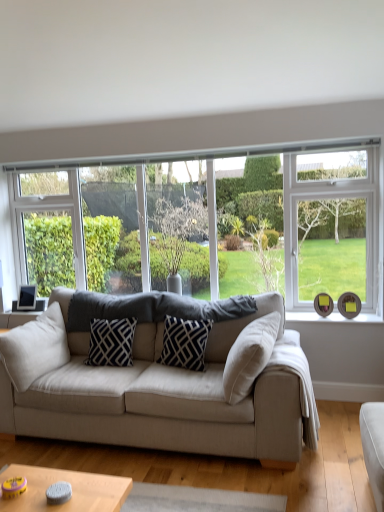
Question: Considering the positions of clear glass window at center and navy blue fabric pillow at center, the first pillow positioned from the right, in the image, is clear glass window at center taller or shorter than navy blue fabric pillow at center, the first pillow positioned from the right,?

Choices:
 (A) short
 (B) tall

Answer: (B)

Question: Considering the relative positions of clear glass window at center and navy blue fabric pillow at center, the 3th pillow in the left-to-right sequence, in the image provided, is clear glass window at center to the left or to the right of navy blue fabric pillow at center, the 3th pillow in the left-to-right sequence,?

Choices:
 (A) right
 (B) left

Answer: (B)

Question: Estimate the real-world distances between objects in this image. Which object is farther from the beige fabric couch at center?

Choices:
 (A) clear glass window at center
 (B) green leafy tree at center
 (C) navy blue fabric pillow at center, the first pillow positioned from the right
 (D) beige fabric pillow at left, which is counted as the first pillow, starting from the left
 (E) black and white patterned pillow at center, arranged as the second pillow when viewed from the right

Answer: (A)

Question: Considering the real-world distances, which object is closest to the green leafy tree at center?

Choices:
 (A) beige fabric pillow at left, which is counted as the first pillow, starting from the left
 (B) navy blue fabric pillow at center, the first pillow positioned from the right
 (C) black and white patterned pillow at center, arranged as the second pillow when viewed from the right
 (D) beige fabric couch at center
 (E) clear glass window at center

Answer: (E)